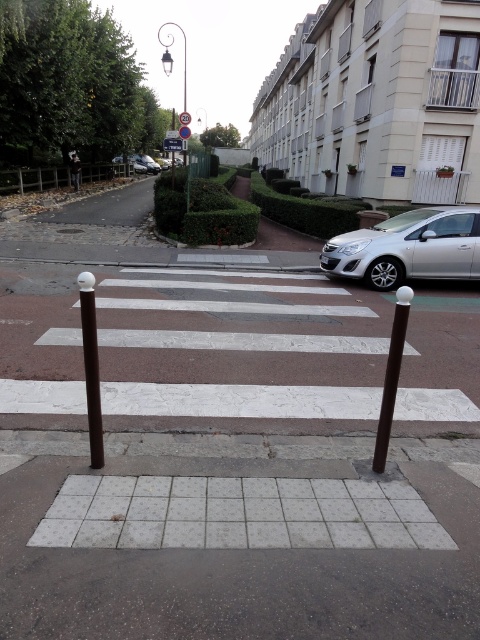
What do you see at coordinates (240, 355) in the screenshot? The height and width of the screenshot is (640, 480). I see `brown metal bollards at center` at bounding box center [240, 355].

The width and height of the screenshot is (480, 640). What do you see at coordinates (240, 355) in the screenshot?
I see `brown metal bollards at center` at bounding box center [240, 355].

Find the location of a particular element. The image size is (480, 640). brown metal bollards at center is located at coordinates (240, 355).

In the scene shown: Does brown matte pole at center have a larger size compared to brown polished pole at lower right?

Incorrect, brown matte pole at center is not larger than brown polished pole at lower right.

Is point (99, 433) more distant than point (387, 413)?

No, it is in front of (387, 413).

Locate an element on the screen. The image size is (480, 640). brown matte pole at center is located at coordinates (91, 365).

Who is positioned more to the right, silver metallic car at right or brown polished pole at lower right?

silver metallic car at right

Looking at this image, which of these two, silver metallic car at right or brown polished pole at lower right, stands taller?

silver metallic car at right is taller.

Where is `silver metallic car at right`? silver metallic car at right is located at coordinates click(x=408, y=248).

The height and width of the screenshot is (640, 480). Identify the location of silver metallic car at right. (408, 248).